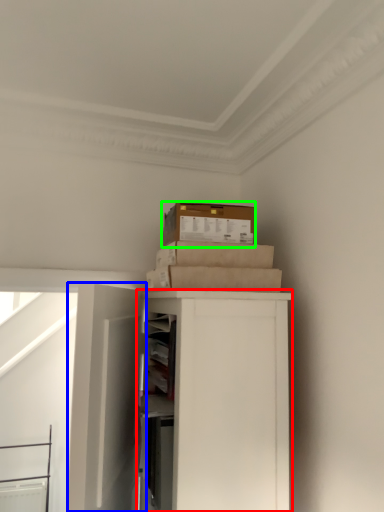
Question: Which object is the closest to the cabinetry (highlighted by a red box)? Choose among these: door (highlighted by a blue box) or box (highlighted by a green box).

Choices:
 (A) door
 (B) box

Answer: (A)